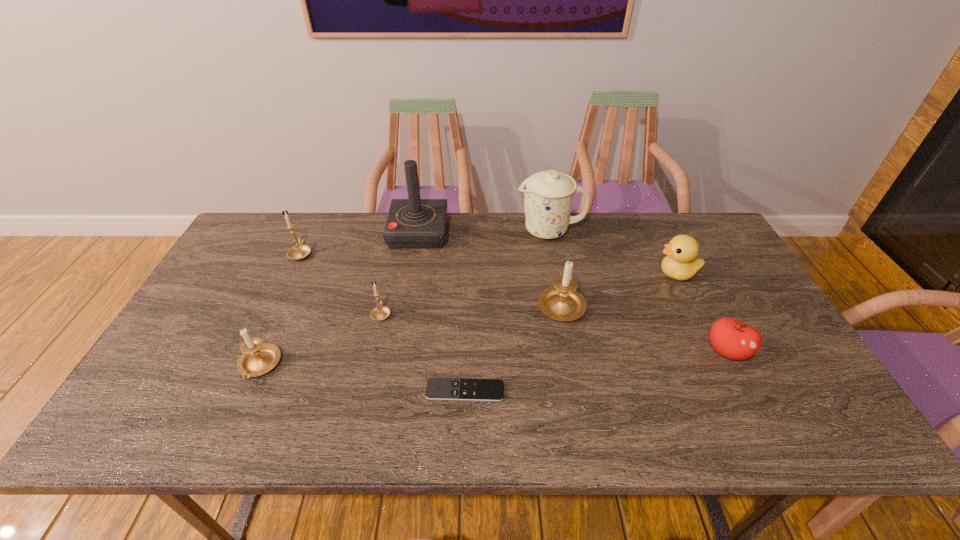
The image size is (960, 540). Identify the location of free point located 0.070m with a handle on the side of the nearer beige candle holder. (238, 414).

The width and height of the screenshot is (960, 540). Find the location of `free space located 0.090m on the front of the apple`. free space located 0.090m on the front of the apple is located at coordinates (753, 401).

Locate an element on the screen. The height and width of the screenshot is (540, 960). free spot located 0.160m on the left of the remote control is located at coordinates (358, 390).

Where is `joystick positioned at the far edge`? joystick positioned at the far edge is located at coordinates (413, 223).

Find the location of a particular element. chinaware positioned at the far edge is located at coordinates (548, 195).

Locate an element on the screen. The image size is (960, 540). candle holder present at the far edge is located at coordinates (298, 252).

This screenshot has height=540, width=960. Identify the location of duck located at the right edge. (680, 263).

Locate an element on the screen. apple at the right edge is located at coordinates (731, 338).

Find the location of `free space at the far edge of the desktop`. free space at the far edge of the desktop is located at coordinates (634, 229).

Where is `vacant space at the near edge of the desktop`? This screenshot has height=540, width=960. vacant space at the near edge of the desktop is located at coordinates (687, 428).